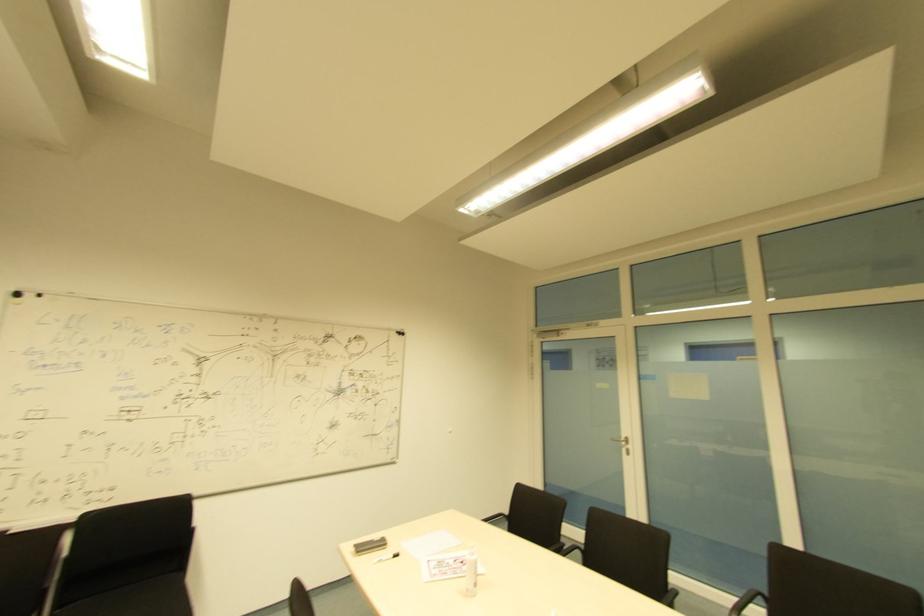
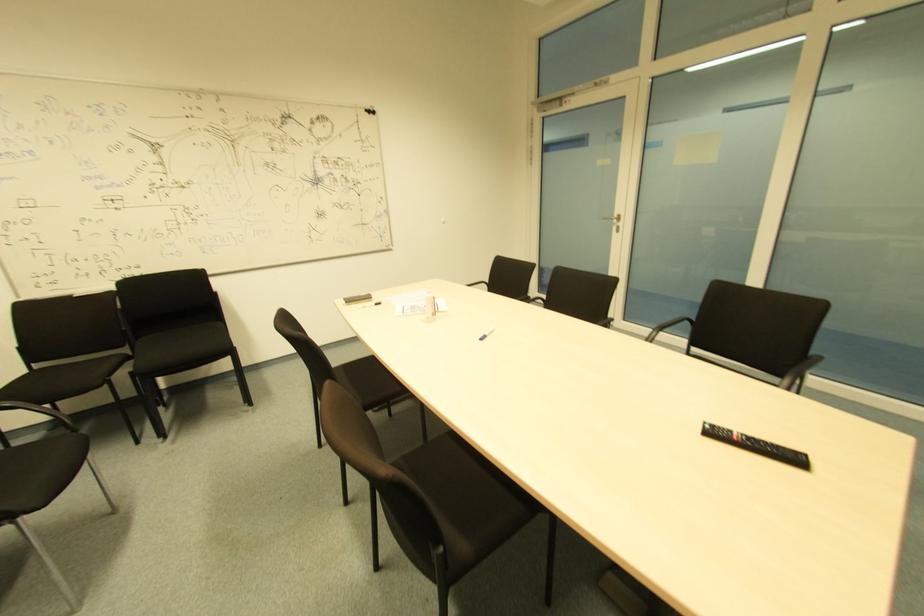
Find the pixel in the second image that matches (381,546) in the first image.

(365, 301)